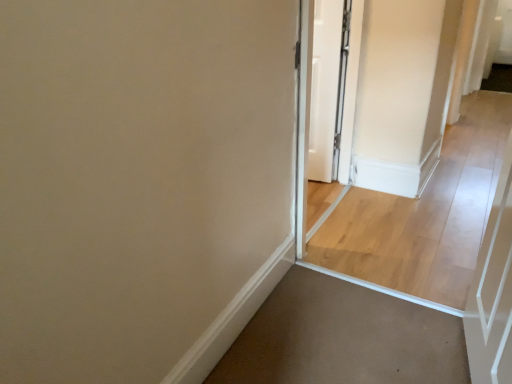
Question: Can you confirm if white glossy screen door at center is shorter than white glossy door at center?

Choices:
 (A) yes
 (B) no

Answer: (B)

Question: Is white glossy screen door at center not inside white glossy door at center?

Choices:
 (A) yes
 (B) no

Answer: (A)

Question: Is white glossy screen door at center in contact with white glossy door at center?

Choices:
 (A) yes
 (B) no

Answer: (A)

Question: Does white glossy screen door at center appear on the right side of white glossy door at center?

Choices:
 (A) no
 (B) yes

Answer: (A)

Question: From the image's perspective, is white glossy screen door at center below white glossy door at center?

Choices:
 (A) yes
 (B) no

Answer: (A)

Question: Considering the relative positions of white glossy screen door at center and white glossy door at center in the image provided, is white glossy screen door at center to the left of white glossy door at center from the viewer's perspective?

Choices:
 (A) no
 (B) yes

Answer: (B)

Question: Is white glossy screen door at center facing towards light wood floor at center?

Choices:
 (A) yes
 (B) no

Answer: (B)

Question: Is light wood floor at center located within white glossy screen door at center?

Choices:
 (A) yes
 (B) no

Answer: (B)

Question: Can you confirm if white glossy screen door at center is smaller than light wood floor at center?

Choices:
 (A) no
 (B) yes

Answer: (B)

Question: Is white glossy screen door at center with light wood floor at center?

Choices:
 (A) no
 (B) yes

Answer: (A)

Question: Is white glossy screen door at center further to camera compared to light wood floor at center?

Choices:
 (A) yes
 (B) no

Answer: (B)

Question: Does white glossy screen door at center appear on the right side of light wood floor at center?

Choices:
 (A) no
 (B) yes

Answer: (A)

Question: Is white glossy door at center oriented away from white glossy screen door at center?

Choices:
 (A) yes
 (B) no

Answer: (B)